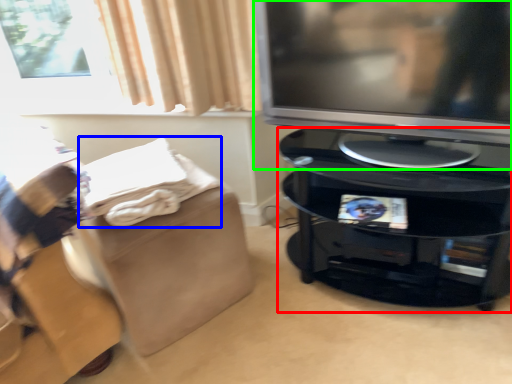
Question: Which object is the farthest from furniture (highlighted by a red box)? Choose among these: blanket (highlighted by a blue box) or television (highlighted by a green box).

Choices:
 (A) blanket
 (B) television

Answer: (A)